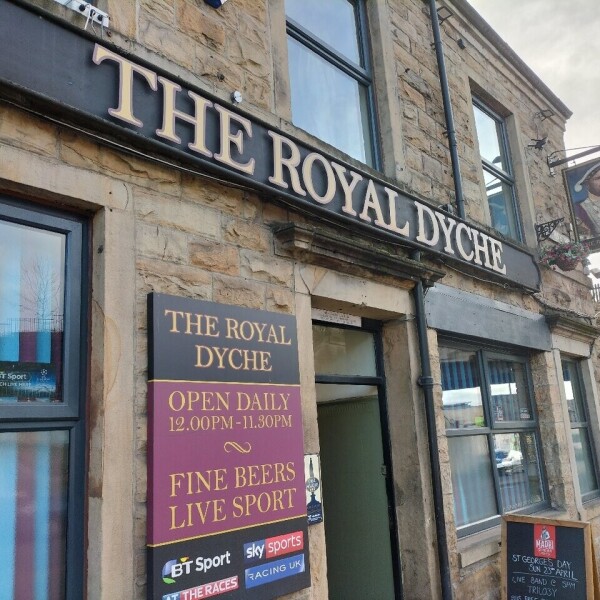
Find the location of a particular element. The image size is (600, 600). door frame is located at coordinates (347, 290).